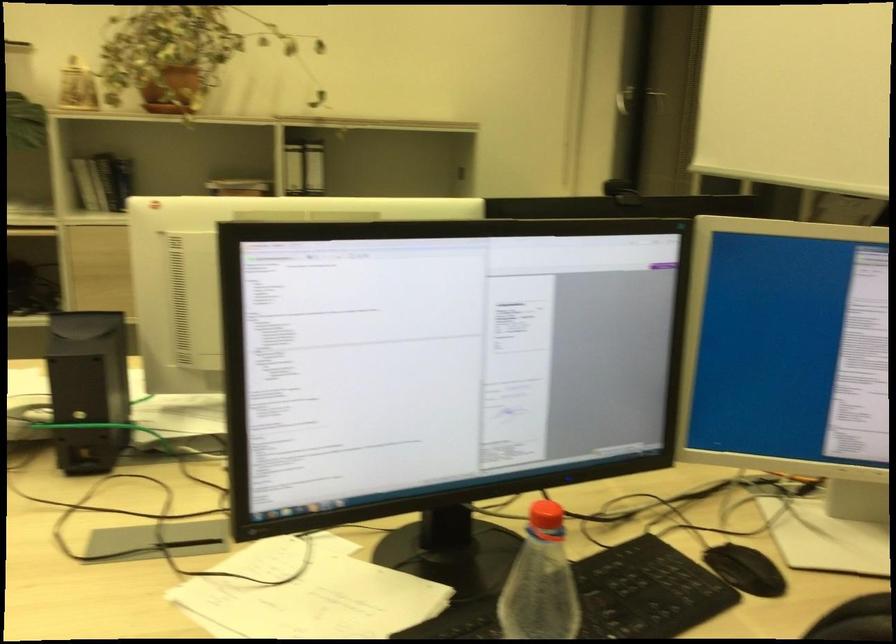
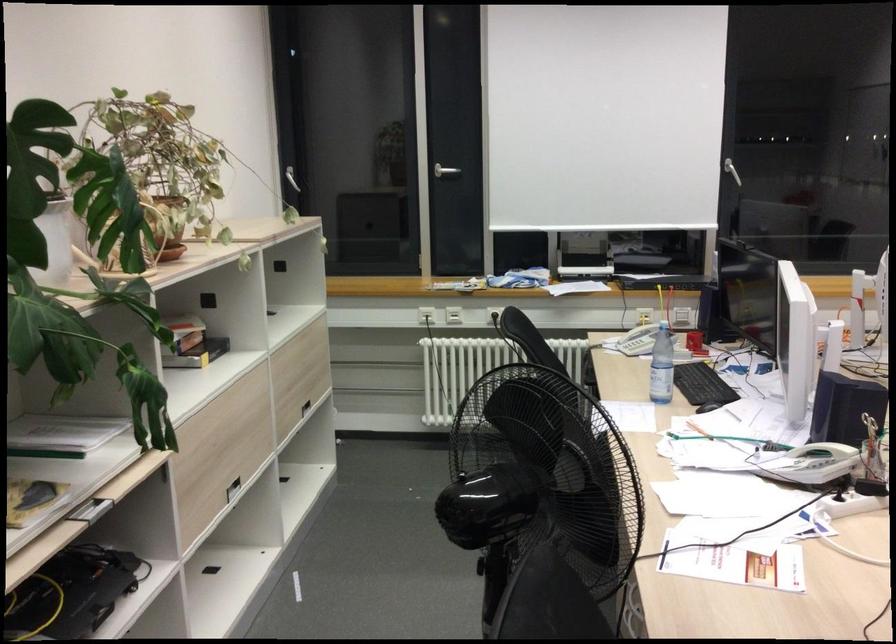
Locate, in the second image, the point that corresponds to (85,411) in the first image.

(814, 464)